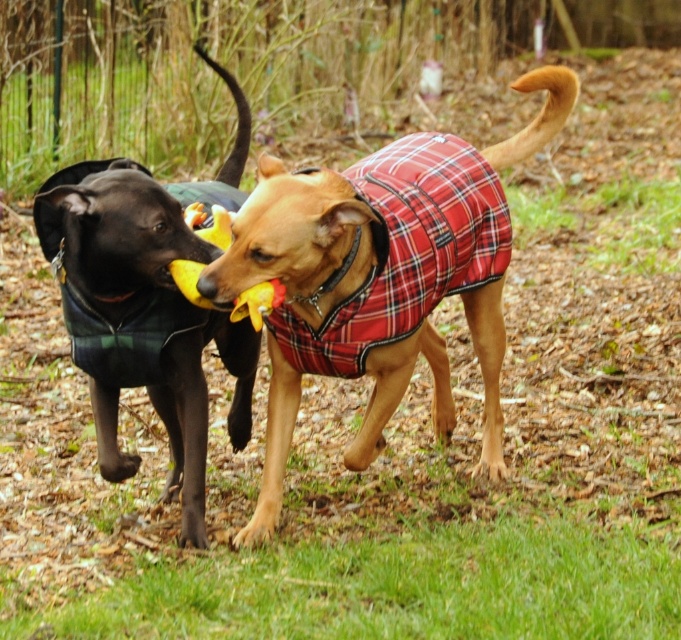
Question: Which point appears farthest from the camera in this image?

Choices:
 (A) (289, 189)
 (B) (131, 352)

Answer: (B)

Question: Is plaid fabric dog coat at center to the left of yellow rubber duck at center from the viewer's perspective?

Choices:
 (A) yes
 (B) no

Answer: (B)

Question: Which point appears closest to the camera in this image?

Choices:
 (A) (340, 177)
 (B) (281, 284)

Answer: (B)

Question: Is shiny black coat at left thinner than plaid fabric dog coat at center?

Choices:
 (A) no
 (B) yes

Answer: (B)

Question: Which of the following is the farthest from the observer?

Choices:
 (A) pyautogui.click(x=101, y=260)
 (B) pyautogui.click(x=259, y=321)
 (C) pyautogui.click(x=477, y=291)

Answer: (C)

Question: Can you confirm if shiny black coat at left is positioned to the left of plaid fabric dog coat at center?

Choices:
 (A) no
 (B) yes

Answer: (B)